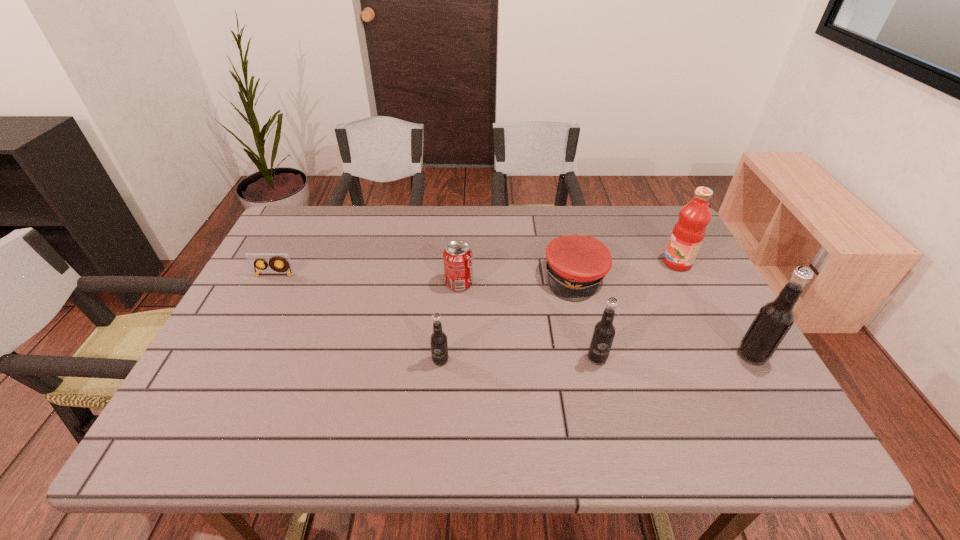
This screenshot has width=960, height=540. What are the coordinates of `free location that satisfies the following two spatial constraints: 1. on the label of the tallest root beer; 2. on the label of the fourth shortest object` in the screenshot? It's located at (755, 360).

Where is `vacant space that satisfies the following two spatial constraints: 1. on the front label of the fruit juice; 2. on the label of the leftmost root beer`? This screenshot has width=960, height=540. vacant space that satisfies the following two spatial constraints: 1. on the front label of the fruit juice; 2. on the label of the leftmost root beer is located at coordinates (728, 360).

Where is `free space that satisfies the following two spatial constraints: 1. on the front label of the fruit juice; 2. on the label of the second shortest root beer`? The image size is (960, 540). free space that satisfies the following two spatial constraints: 1. on the front label of the fruit juice; 2. on the label of the second shortest root beer is located at coordinates (726, 358).

Locate an element on the screen. The width and height of the screenshot is (960, 540). vacant space that satisfies the following two spatial constraints: 1. on the front label of the fruit juice; 2. on the label of the fifth shortest object is located at coordinates (726, 358).